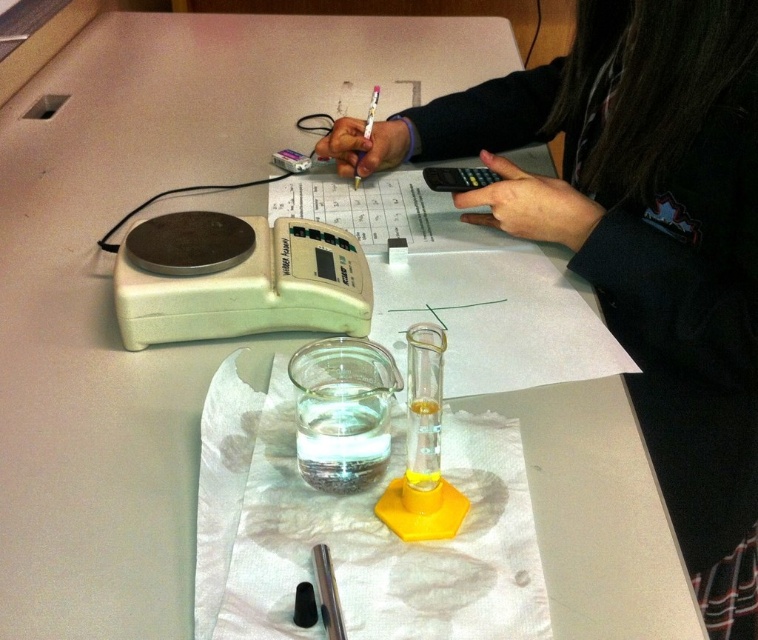
Question: Can you confirm if white plastic electronic balance at center is positioned to the left of black plastic calculator at upper center?

Choices:
 (A) no
 (B) yes

Answer: (B)

Question: Considering the relative positions of white plastic electronic balance at center and black plastic calculator at upper center in the image provided, where is white plastic electronic balance at center located with respect to black plastic calculator at upper center?

Choices:
 (A) above
 (B) below

Answer: (B)

Question: Among these points, which one is farthest from the camera?

Choices:
 (A) (312, 276)
 (B) (459, 189)

Answer: (B)

Question: Is the position of white plastic electronic balance at center more distant than that of black plastic calculator at upper center?

Choices:
 (A) yes
 (B) no

Answer: (B)